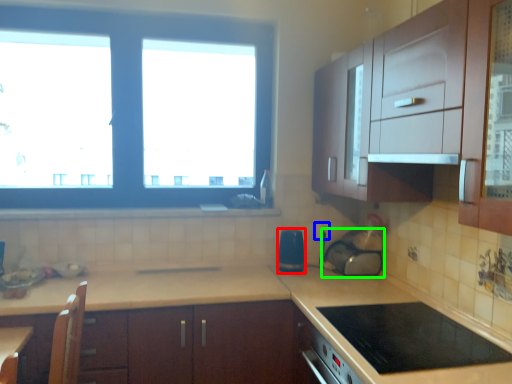
Question: Which object is positioned farthest from appliance (highlighted by a red box)? Select from electric outlet (highlighted by a blue box) and appliance (highlighted by a green box).

Choices:
 (A) electric outlet
 (B) appliance

Answer: (B)